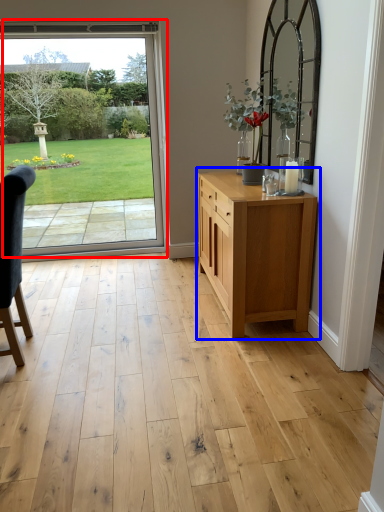
Question: Among these objects, which one is nearest to the camera, door (highlighted by a red box) or chest of drawers (highlighted by a blue box)?

Choices:
 (A) door
 (B) chest of drawers

Answer: (B)